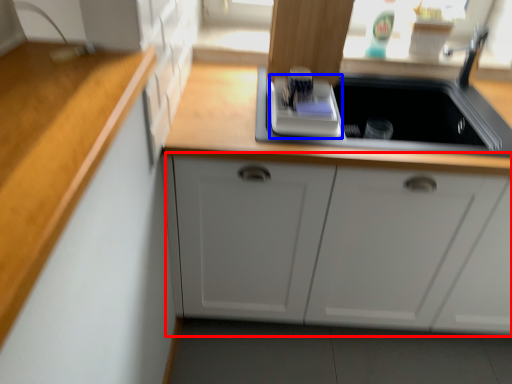
Question: Which object appears farthest to the camera in this image, cabinetry (highlighted by a red box) or appliance (highlighted by a blue box)?

Choices:
 (A) cabinetry
 (B) appliance

Answer: (B)